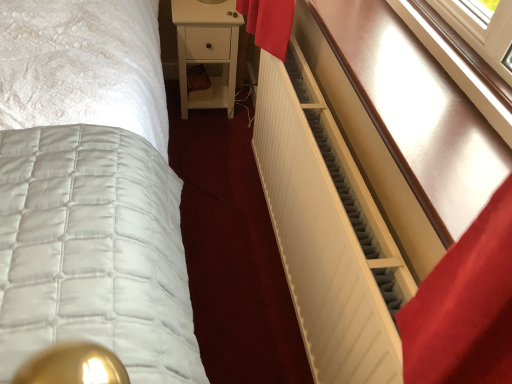
Question: Is white quilted bed at center bigger than white matte nightstand at center?

Choices:
 (A) yes
 (B) no

Answer: (A)

Question: Is white quilted bed at center facing away from white matte nightstand at center?

Choices:
 (A) yes
 (B) no

Answer: (B)

Question: Is white quilted bed at center at the right side of white matte nightstand at center?

Choices:
 (A) no
 (B) yes

Answer: (A)

Question: Can you confirm if white quilted bed at center is positioned to the left of white matte nightstand at center?

Choices:
 (A) yes
 (B) no

Answer: (A)

Question: Can white matte nightstand at center be found inside white quilted bed at center?

Choices:
 (A) no
 (B) yes

Answer: (A)

Question: From the image's perspective, does white quilted bed at center appear lower than white matte nightstand at center?

Choices:
 (A) yes
 (B) no

Answer: (A)

Question: Considering the relative sizes of white matte nightstand at center and white quilted bed at center in the image provided, is white matte nightstand at center bigger than white quilted bed at center?

Choices:
 (A) yes
 (B) no

Answer: (B)

Question: Is white matte nightstand at center thinner than white quilted bed at center?

Choices:
 (A) no
 (B) yes

Answer: (B)

Question: Could you tell me if white matte nightstand at center is turned towards white quilted bed at center?

Choices:
 (A) yes
 (B) no

Answer: (A)

Question: Can you confirm if white matte nightstand at center is positioned to the right of white quilted bed at center?

Choices:
 (A) yes
 (B) no

Answer: (A)

Question: From a real-world perspective, is white matte nightstand at center located higher than white quilted bed at center?

Choices:
 (A) yes
 (B) no

Answer: (A)

Question: Does white matte nightstand at center have a greater height compared to white quilted bed at center?

Choices:
 (A) yes
 (B) no

Answer: (A)

Question: Could you tell me if matte white radiator at right is turned towards white matte nightstand at center?

Choices:
 (A) no
 (B) yes

Answer: (A)